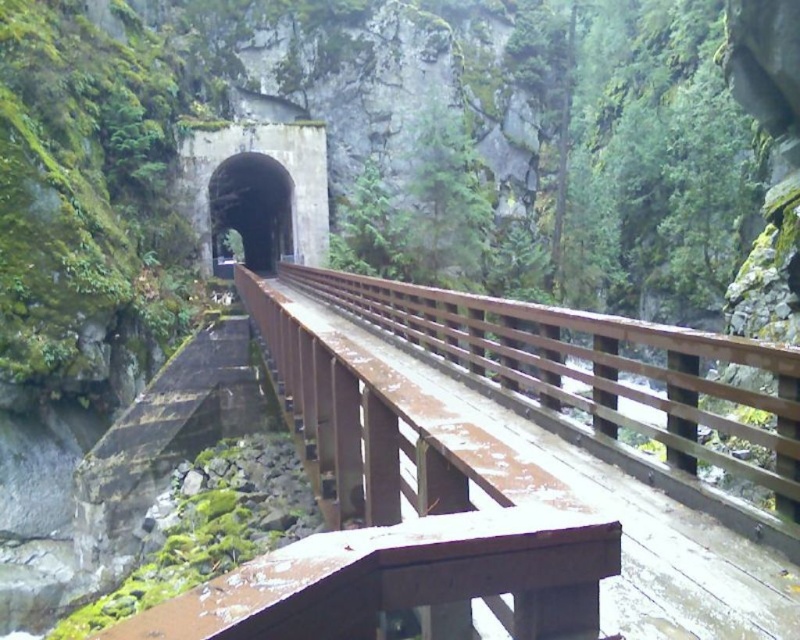
Question: Does concrete tunnel at center come in front of black concrete tunnel at center?

Choices:
 (A) yes
 (B) no

Answer: (B)

Question: Which of these objects is positioned closest to the concrete tunnel at center?

Choices:
 (A) black concrete tunnel at center
 (B) rusty wood bridge at center

Answer: (A)

Question: Considering the real-world distances, which object is farthest from the rusty wood bridge at center?

Choices:
 (A) concrete tunnel at center
 (B) black concrete tunnel at center

Answer: (A)

Question: Is concrete tunnel at center smaller than black concrete tunnel at center?

Choices:
 (A) yes
 (B) no

Answer: (A)

Question: Can you confirm if rusty wood bridge at center is bigger than black concrete tunnel at center?

Choices:
 (A) no
 (B) yes

Answer: (A)

Question: Which point is farther from the camera taking this photo?

Choices:
 (A) (264, 170)
 (B) (270, 136)
 (C) (466, 410)

Answer: (A)